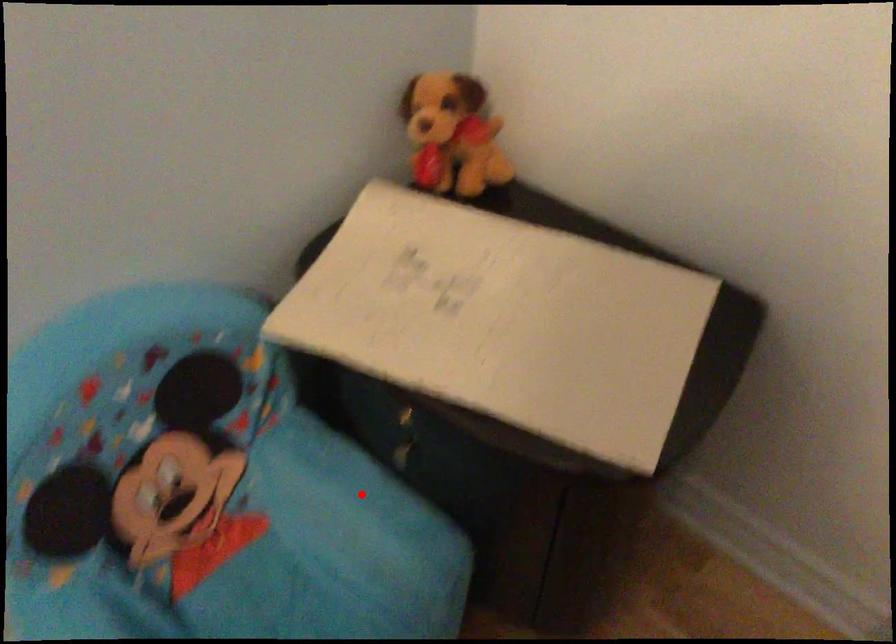
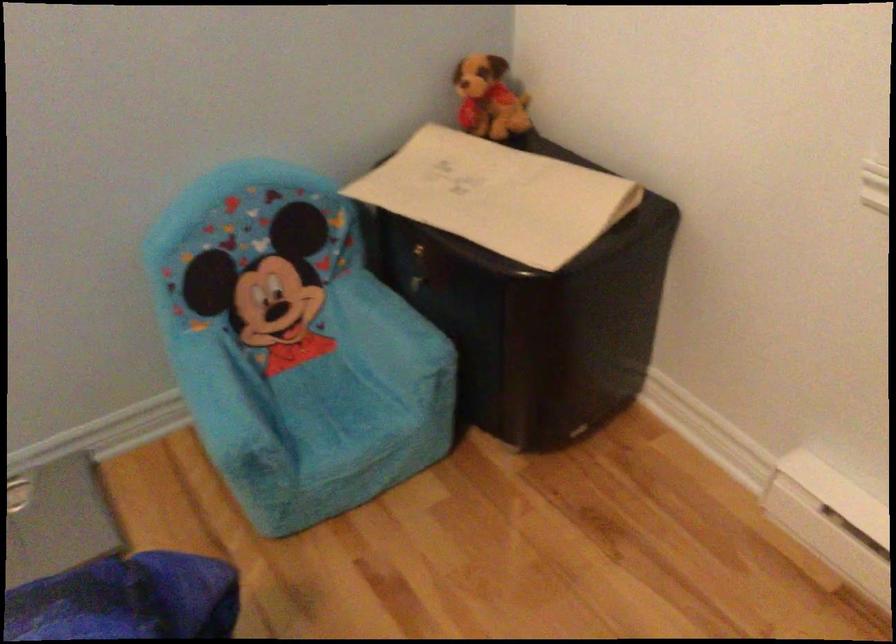
Question: I am providing you with two images of the same scene from different viewpoints. Image1 has a red point marked. In image2, the corresponding 3D location appears at what relative position? Reply with the corresponding letter.

Choices:
 (A) Closer
 (B) Farther

Answer: (B)